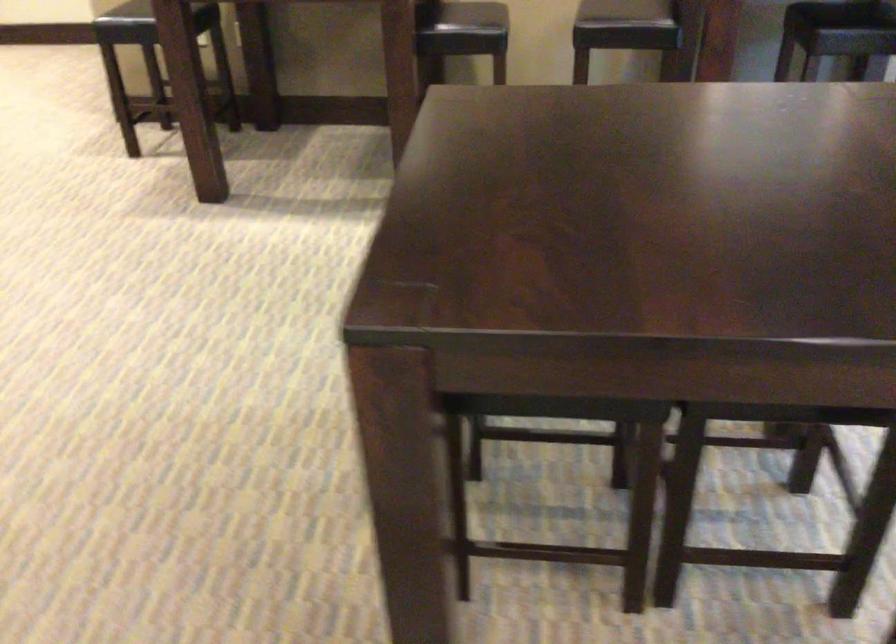
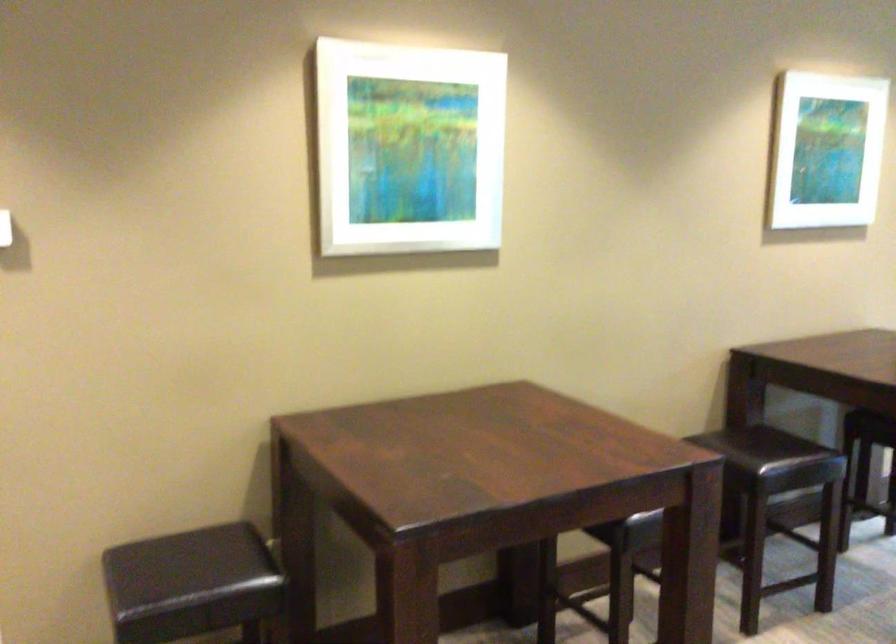
Question: I am providing you with two images of the same scene from different viewpoints. After the viewpoint changes to image2, which objects are now occluded?

Choices:
 (A) chair sitting surface
 (B) white framed art
 (C) wooden tray
 (D) dark chair sitting surface

Answer: (A)